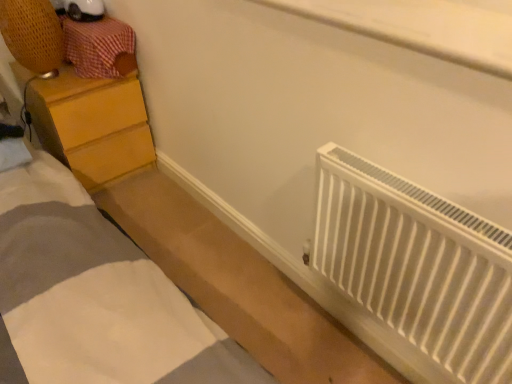
You are a GUI agent. You are given a task and a screenshot of the screen. Output one action in this format:
    pyautogui.click(x=<x>, y=<y>)
    Task: Click on the vacant region above wooden drawer at upper left (from a real-world perspective)
    
    Given the screenshot: What is the action you would take?
    pyautogui.click(x=88, y=21)